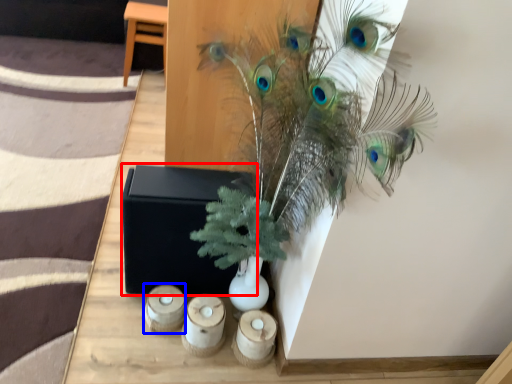
Question: Among these objects, which one is nearest to the camera, box (highlighted by a red box) or candle holder (highlighted by a blue box)?

Choices:
 (A) box
 (B) candle holder

Answer: (A)